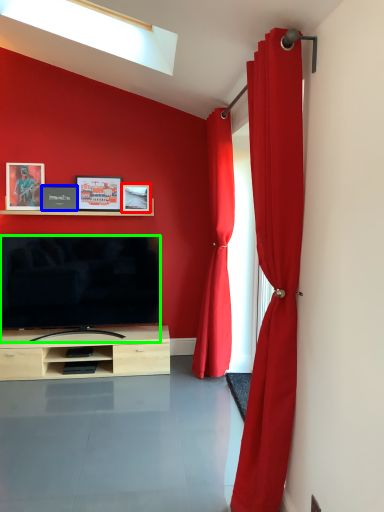
Question: Which is nearer to the picture frame (highlighted by a red box)? picture frame (highlighted by a blue box) or television (highlighted by a green box).

Choices:
 (A) picture frame
 (B) television

Answer: (A)